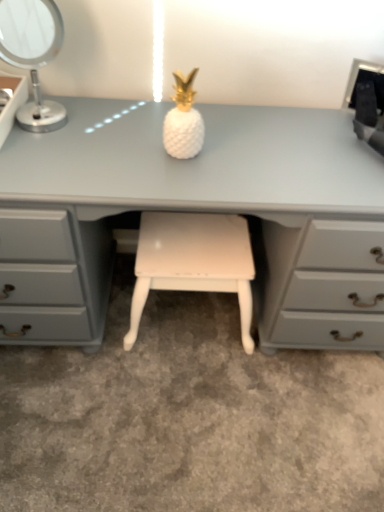
Question: Is white painted wood stool at center inside the boundaries of black plastic desktop computer at upper right, or outside?

Choices:
 (A) inside
 (B) outside

Answer: (B)

Question: From a real-world perspective, is white painted wood stool at center above or below black plastic desktop computer at upper right?

Choices:
 (A) above
 (B) below

Answer: (B)

Question: Which is nearer to the matte white desk at center?

Choices:
 (A) black plastic desktop computer at upper right
 (B) white painted wood stool at center
 (C) white glossy pineapple at center
 (D) silver metallic table lamp at upper left

Answer: (C)

Question: Considering the real-world distances, which object is farthest from the white glossy pineapple at center?

Choices:
 (A) silver metallic table lamp at upper left
 (B) matte white desk at center
 (C) white painted wood stool at center
 (D) black plastic desktop computer at upper right

Answer: (D)